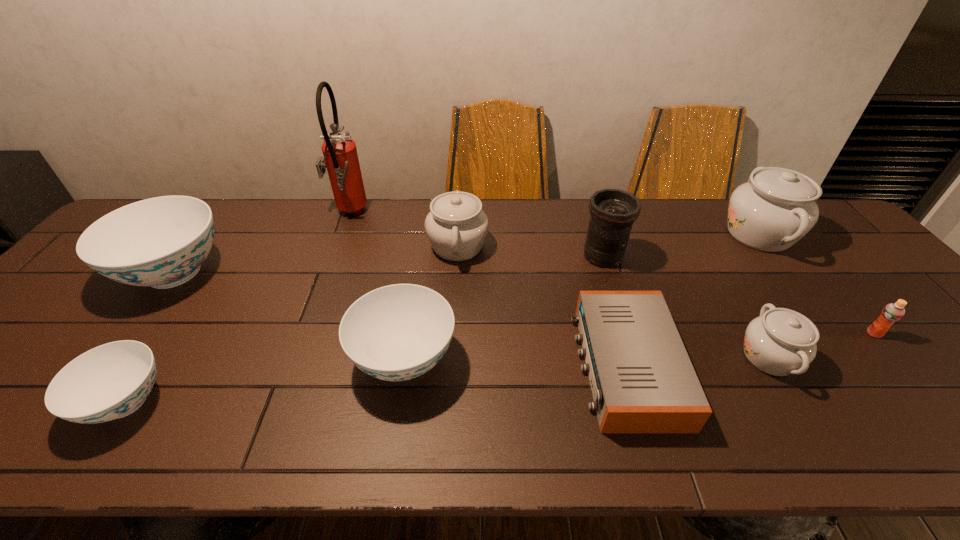
The width and height of the screenshot is (960, 540). What are the coordinates of `free space that is in between the orange juice and the biggest blue chinaware` in the screenshot? It's located at (524, 303).

Locate an element on the screen. vacant space in between the tallest chinaware and the shortest object is located at coordinates (692, 300).

Locate an element on the screen. Image resolution: width=960 pixels, height=540 pixels. unoccupied position between the fire extinguisher and the orange juice is located at coordinates coord(612,274).

Locate an element on the screen. vacant space in between the shortest object and the tallest object is located at coordinates (488, 290).

Locate an element on the screen. This screenshot has height=540, width=960. empty space that is in between the orange juice and the third object from left to right is located at coordinates (612, 274).

At what (x,y) coordinates should I click in order to perform the action: click on vacant region between the smallest white chinaware and the tallest chinaware. Please return your answer as a coordinate pair (x, y). Looking at the image, I should click on coord(764,295).

The height and width of the screenshot is (540, 960). In order to click on free space that is in between the tallest object and the eighth object from left to right in this screenshot , I will do `click(559, 285)`.

Select which object is the ninth closest to the second biggest blue chinaware. Please provide its 2D coordinates. Your answer should be formatted as a tuple, i.e. [(x, y)], where the tuple contains the x and y coordinates of a point satisfying the conditions above.

[(892, 312)]

Find the location of a particular element. the closest object relative to the rightmost blue chinaware is located at coordinates (456, 226).

Where is `chinaware that is the third closest one to the rightmost chinaware`? chinaware that is the third closest one to the rightmost chinaware is located at coordinates (398, 332).